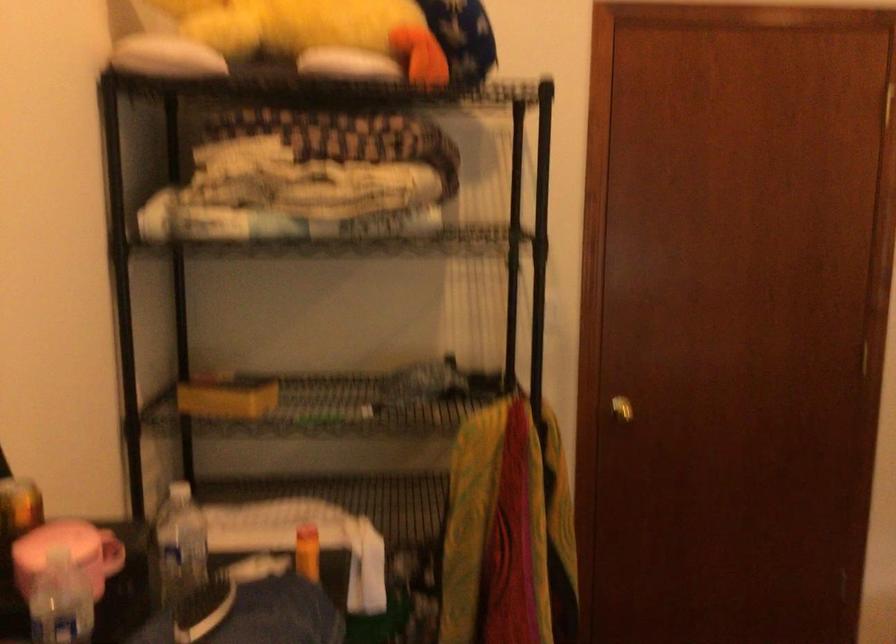
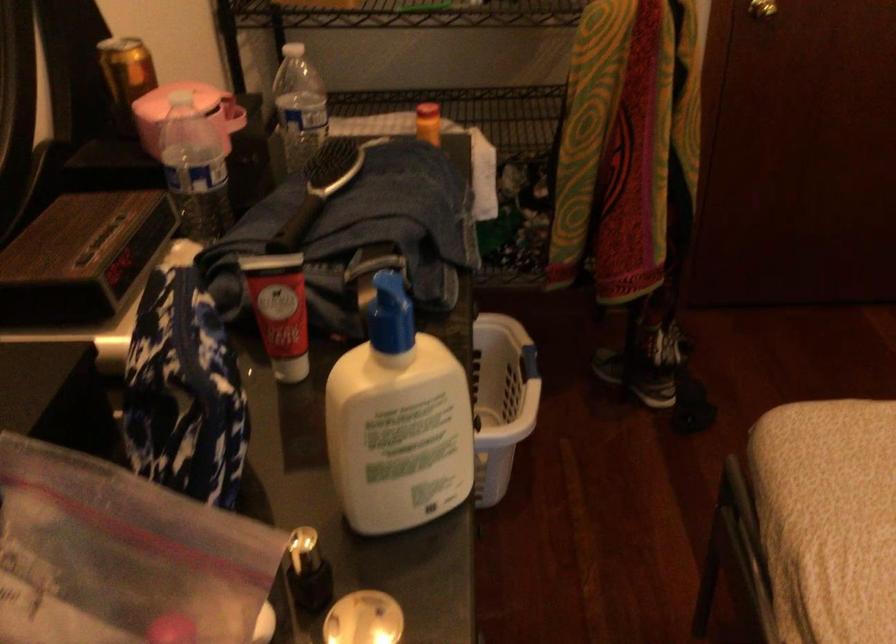
Find the pixel in the second image that matches point (177, 540) in the first image.

(298, 106)